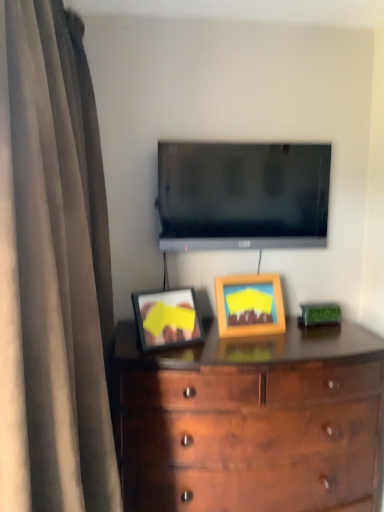
Question: Is wooden picture frame at center to the right of brown fabric curtain at left from the viewer's perspective?

Choices:
 (A) no
 (B) yes

Answer: (B)

Question: Does wooden picture frame at center turn towards brown fabric curtain at left?

Choices:
 (A) no
 (B) yes

Answer: (A)

Question: Is wooden picture frame at center thinner than brown fabric curtain at left?

Choices:
 (A) no
 (B) yes

Answer: (B)

Question: Considering the relative positions of wooden picture frame at center and brown fabric curtain at left in the image provided, is wooden picture frame at center in front of brown fabric curtain at left?

Choices:
 (A) no
 (B) yes

Answer: (A)

Question: Is brown fabric curtain at left located within wooden picture frame at center?

Choices:
 (A) yes
 (B) no

Answer: (B)

Question: Does wooden picture frame at center appear on the left side of brown fabric curtain at left?

Choices:
 (A) no
 (B) yes

Answer: (A)

Question: Is flat screen tv at upper center at the back of brown fabric curtain at left?

Choices:
 (A) no
 (B) yes

Answer: (A)

Question: Does brown fabric curtain at left come behind flat screen tv at upper center?

Choices:
 (A) no
 (B) yes

Answer: (A)

Question: Does brown fabric curtain at left have a larger size compared to flat screen tv at upper center?

Choices:
 (A) no
 (B) yes

Answer: (B)

Question: Does brown fabric curtain at left have a greater height compared to flat screen tv at upper center?

Choices:
 (A) no
 (B) yes

Answer: (B)

Question: From a real-world perspective, does brown fabric curtain at left stand above flat screen tv at upper center?

Choices:
 (A) yes
 (B) no

Answer: (B)

Question: Is brown fabric curtain at left positioned far away from flat screen tv at upper center?

Choices:
 (A) yes
 (B) no

Answer: (B)

Question: Are flat screen tv at upper center and brown fabric curtain at left located far from each other?

Choices:
 (A) yes
 (B) no

Answer: (B)